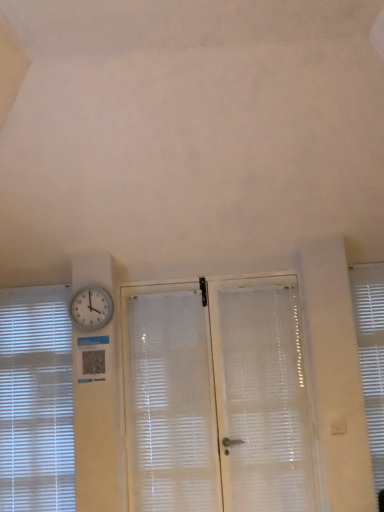
What are the coordinates of `white frosted glass screen door at center` in the screenshot? It's located at (217, 397).

Describe the element at coordinates (36, 400) in the screenshot. I see `white translucent blinds at left, the 1th window blind viewed from the left` at that location.

This screenshot has height=512, width=384. I want to click on white textured window blind at right, the 1th window blind viewed from the right, so click(371, 354).

Is white textured window blind at right, the 1th window blind viewed from the right, closer to the viewer compared to white frosted glass screen door at center?

That is True.

Is white textured window blind at right, the 1th window blind viewed from the right, directly adjacent to white frosted glass screen door at center?

They are not placed beside each other.

Locate an element on the screen. This screenshot has height=512, width=384. screen door lying on the left of white textured window blind at right, the second window blind positioned from the left is located at coordinates (217, 397).

Is white textured window blind at right, the 1th window blind viewed from the right, oriented away from white frosted glass screen door at center?

white textured window blind at right, the 1th window blind viewed from the right, is not turned away from white frosted glass screen door at center.

Can white glossy clock at upper left be found inside white translucent blinds at left, the 1th window blind viewed from the left?

No, white glossy clock at upper left is not surrounded by white translucent blinds at left, the 1th window blind viewed from the left.

Does white translucent blinds at left, the 1th window blind viewed from the left, turn towards white glossy clock at upper left?

No, white translucent blinds at left, the 1th window blind viewed from the left, is not facing towards white glossy clock at upper left.

Who is taller, white translucent blinds at left, which appears as the 2th window blind when viewed from the right, or white glossy clock at upper left?

white translucent blinds at left, which appears as the 2th window blind when viewed from the right, is taller.

From the picture: Would you consider white translucent blinds at left, which appears as the 2th window blind when viewed from the right, to be distant from white glossy clock at upper left?

Actually, white translucent blinds at left, which appears as the 2th window blind when viewed from the right, and white glossy clock at upper left are a little close together.

Would you say white glossy clock at upper left is a long distance from white translucent shutter at center?

white glossy clock at upper left is near white translucent shutter at center, not far away.

Does white glossy clock at upper left have a lesser height compared to white translucent shutter at center?

Yes.

Does white glossy clock at upper left have a lesser width compared to white translucent shutter at center?

Correct, the width of white glossy clock at upper left is less than that of white translucent shutter at center.

From a real-world perspective, is white glossy clock at upper left under white translucent shutter at center?

No, from a real-world perspective, white glossy clock at upper left is not below white translucent shutter at center.

Considering the positions of objects white frosted glass screen door at center and white glossy clock at upper left in the image provided, who is in front, white frosted glass screen door at center or white glossy clock at upper left?

Positioned in front is white frosted glass screen door at center.

Is white frosted glass screen door at center facing away from white glossy clock at upper left?

That's not correct — white frosted glass screen door at center is not looking away from white glossy clock at upper left.

I want to click on clock that appears behind the white frosted glass screen door at center, so click(x=91, y=308).

Find the location of `screen door behind the white translucent shutter at center`. screen door behind the white translucent shutter at center is located at coordinates (217, 397).

From a real-world perspective, is white frosted glass screen door at center beneath white translucent shutter at center?

No, from a real-world perspective, white frosted glass screen door at center is not under white translucent shutter at center.

How distant is white frosted glass screen door at center from white translucent shutter at center?

white frosted glass screen door at center is 4.13 inches from white translucent shutter at center.

Does white frosted glass screen door at center have a greater height compared to white translucent shutter at center?

Correct, white frosted glass screen door at center is much taller as white translucent shutter at center.

From the image's perspective, is white glossy clock at upper left under white translucent blinds at left, which appears as the 2th window blind when viewed from the right?

No, from the image's perspective, white glossy clock at upper left is not below white translucent blinds at left, which appears as the 2th window blind when viewed from the right.

Is white glossy clock at upper left to the left of white translucent blinds at left, the 1th window blind viewed from the left, from the viewer's perspective?

Incorrect, white glossy clock at upper left is not on the left side of white translucent blinds at left, the 1th window blind viewed from the left.

Does white glossy clock at upper left have a larger size compared to white translucent blinds at left, which appears as the 2th window blind when viewed from the right?

No.

Is white glossy clock at upper left surrounding white translucent blinds at left, which appears as the 2th window blind when viewed from the right?

No, white translucent blinds at left, which appears as the 2th window blind when viewed from the right, is not surrounded by white glossy clock at upper left.

The height and width of the screenshot is (512, 384). I want to click on clock on the left side of white textured window blind at right, the second window blind positioned from the left, so click(x=91, y=308).

Which of these two, white glossy clock at upper left or white textured window blind at right, the second window blind positioned from the left, is thinner?

Thinner between the two is white glossy clock at upper left.

Which object is closer to the camera, white glossy clock at upper left or white textured window blind at right, the 1th window blind viewed from the right?

white textured window blind at right, the 1th window blind viewed from the right.

In the scene shown: Can you confirm if white glossy clock at upper left is smaller than white textured window blind at right, the second window blind positioned from the left?

Indeed, white glossy clock at upper left has a smaller size compared to white textured window blind at right, the second window blind positioned from the left.

Find the location of `window blind in front of the white frosted glass screen door at center`. window blind in front of the white frosted glass screen door at center is located at coordinates 371,354.

Identify the location of the 2nd window blind below when counting from the white glossy clock at upper left (from the image's perspective). This screenshot has width=384, height=512. (36, 400).

Which object lies nearer to the anchor point white frosted glass screen door at center, white textured window blind at right, the 1th window blind viewed from the right, or white translucent shutter at center?

The object closer to white frosted glass screen door at center is white translucent shutter at center.

Considering their positions, is white translucent shutter at center positioned further to white textured window blind at right, the second window blind positioned from the left, than white translucent blinds at left, the 1th window blind viewed from the left?

white translucent blinds at left, the 1th window blind viewed from the left, is further to white textured window blind at right, the second window blind positioned from the left.

From the image, which object appears to be nearer to white glossy clock at upper left, white translucent shutter at center or white translucent blinds at left, the 1th window blind viewed from the left?

white translucent blinds at left, the 1th window blind viewed from the left, is positioned closer to the anchor white glossy clock at upper left.

Looking at the image, which one is located further to white glossy clock at upper left, white translucent blinds at left, which appears as the 2th window blind when viewed from the right, or white translucent shutter at center?

Among the two, white translucent shutter at center is located further to white glossy clock at upper left.

Based on their spatial positions, is white glossy clock at upper left or white textured window blind at right, the 1th window blind viewed from the right, closer to white translucent shutter at center?

white glossy clock at upper left.

Looking at the image, which one is located closer to white translucent blinds at left, the 1th window blind viewed from the left, white glossy clock at upper left or white translucent shutter at center?

white glossy clock at upper left.

Based on their spatial positions, is white frosted glass screen door at center or white translucent blinds at left, the 1th window blind viewed from the left, further from white glossy clock at upper left?

The object further to white glossy clock at upper left is white frosted glass screen door at center.

When comparing their distances from white textured window blind at right, the 1th window blind viewed from the right, does white translucent shutter at center or white frosted glass screen door at center seem closer?

white frosted glass screen door at center is closer to white textured window blind at right, the 1th window blind viewed from the right.

Image resolution: width=384 pixels, height=512 pixels. Identify the location of shutter between white glossy clock at upper left and white textured window blind at right, the 1th window blind viewed from the right. tap(169, 400).

At what (x,y) coordinates should I click in order to perform the action: click on clock located between white translucent blinds at left, which appears as the 2th window blind when viewed from the right, and white frosted glass screen door at center in the left-right direction. Please return your answer as a coordinate pair (x, y). Image resolution: width=384 pixels, height=512 pixels. Looking at the image, I should click on (91, 308).

Identify the location of shutter between white glossy clock at upper left and white frosted glass screen door at center in the horizontal direction. (169, 400).

Locate an element on the screen. The image size is (384, 512). screen door located between white translucent blinds at left, which appears as the 2th window blind when viewed from the right, and white textured window blind at right, the second window blind positioned from the left, in the left-right direction is located at coordinates (217, 397).